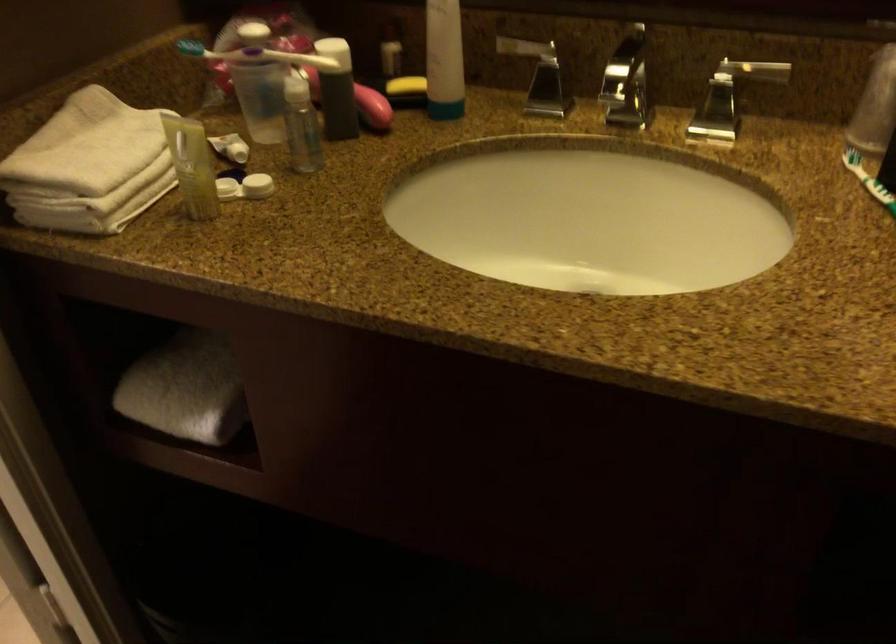
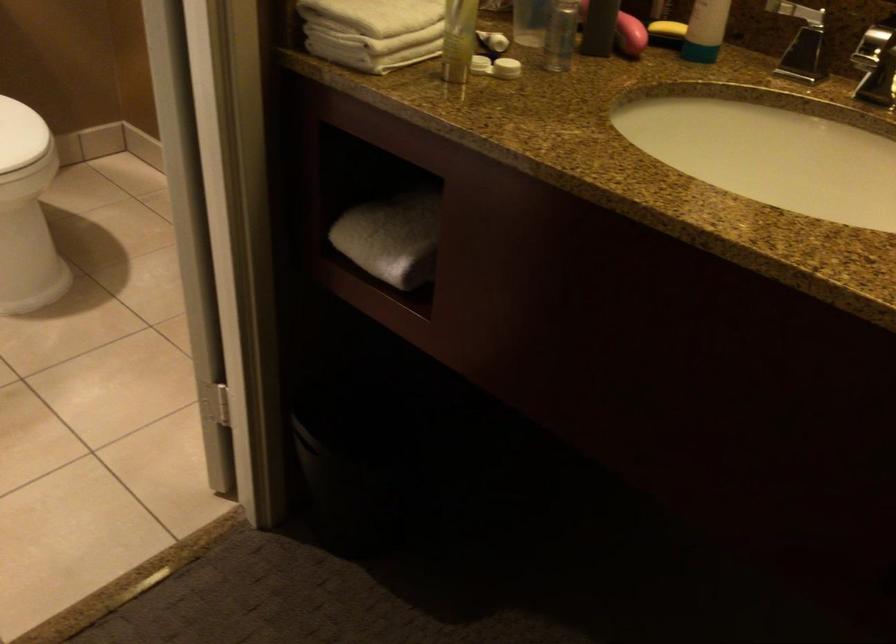
Find the pixel in the second image that matches pixel 92 164 in the first image.

(380, 14)